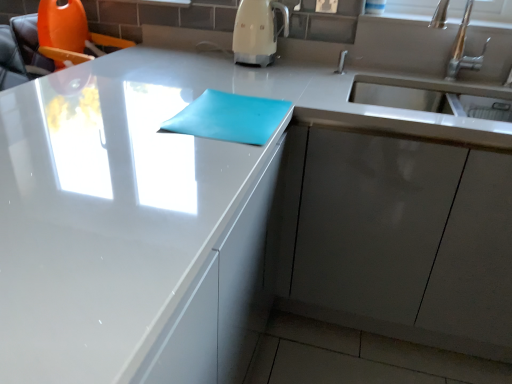
Question: From the image's perspective, is matte blue notepad at center below white glossy coffee machine at upper center?

Choices:
 (A) yes
 (B) no

Answer: (A)

Question: Is matte blue notepad at center turned away from white glossy coffee machine at upper center?

Choices:
 (A) no
 (B) yes

Answer: (A)

Question: From the image's perspective, is matte blue notepad at center above white glossy coffee machine at upper center?

Choices:
 (A) yes
 (B) no

Answer: (B)

Question: Is the depth of matte blue notepad at center less than that of white glossy coffee machine at upper center?

Choices:
 (A) yes
 (B) no

Answer: (A)

Question: From a real-world perspective, is matte blue notepad at center beneath white glossy coffee machine at upper center?

Choices:
 (A) yes
 (B) no

Answer: (A)

Question: Choose the correct answer: Is matte blue notepad at center inside matte gray cabinet at lower right or outside it?

Choices:
 (A) inside
 (B) outside

Answer: (B)

Question: Is matte blue notepad at center in front of or behind matte gray cabinet at lower right in the image?

Choices:
 (A) front
 (B) behind

Answer: (A)

Question: From a real-world perspective, is matte blue notepad at center physically located above or below matte gray cabinet at lower right?

Choices:
 (A) below
 (B) above

Answer: (B)

Question: Considering the positions of matte blue notepad at center and matte gray cabinet at lower right in the image, is matte blue notepad at center wider or thinner than matte gray cabinet at lower right?

Choices:
 (A) thin
 (B) wide

Answer: (A)

Question: From a real-world perspective, is matte blue notepad at center above or below white glossy coffee machine at upper center?

Choices:
 (A) above
 (B) below

Answer: (B)

Question: Is point [229, 117] closer or farther from the camera than point [264, 66]?

Choices:
 (A) closer
 (B) farther

Answer: (A)

Question: Considering the positions of matte blue notepad at center and white glossy coffee machine at upper center in the image, is matte blue notepad at center bigger or smaller than white glossy coffee machine at upper center?

Choices:
 (A) small
 (B) big

Answer: (A)

Question: Would you say matte blue notepad at center is inside or outside white glossy coffee machine at upper center?

Choices:
 (A) outside
 (B) inside

Answer: (A)

Question: From the image's perspective, relative to matte blue notepad at center, is white glossy coffee machine at upper center above or below?

Choices:
 (A) above
 (B) below

Answer: (A)

Question: Is point (270, 16) positioned closer to the camera than point (243, 112)?

Choices:
 (A) farther
 (B) closer

Answer: (A)